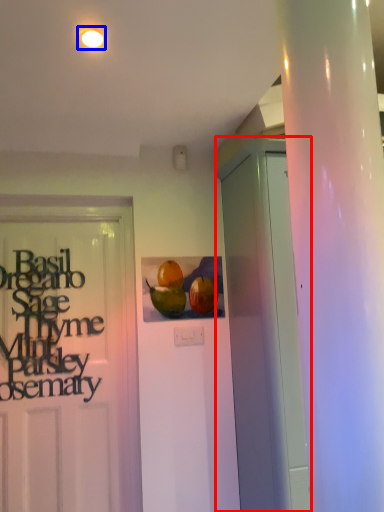
Question: Which point is further to the camera, garage door (highlighted by a red box) or lighting (highlighted by a blue box)?

Choices:
 (A) garage door
 (B) lighting

Answer: (A)